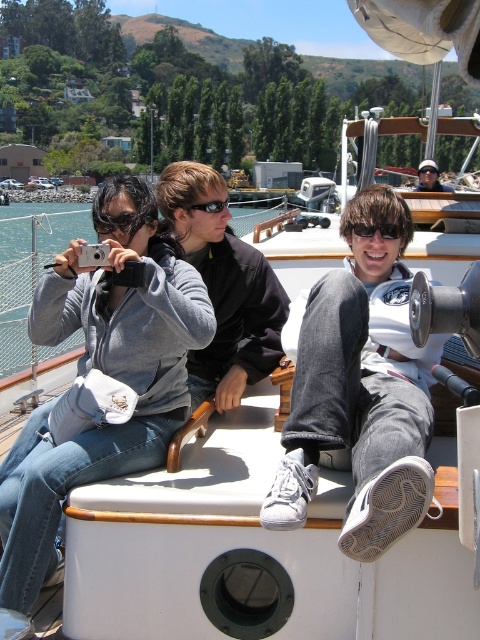
Is dark brown leather jacket at center smaller than black rubber sunglasses at center?

Incorrect, dark brown leather jacket at center is not smaller in size than black rubber sunglasses at center.

Measure the distance from dark brown leather jacket at center to black rubber sunglasses at center.

The distance of dark brown leather jacket at center from black rubber sunglasses at center is 17.88 inches.

Identify the location of dark brown leather jacket at center. This screenshot has width=480, height=640. (224, 288).

In order to click on dark brown leather jacket at center in this screenshot , I will do `click(224, 288)`.

Between matte black sunglasses at upper right and black rubber sunglasses at center, which one appears on the left side from the viewer's perspective?

black rubber sunglasses at center

Can you confirm if matte black sunglasses at upper right is wider than black rubber sunglasses at center?

Yes.

At what (x,y) coordinates should I click in order to perform the action: click on matte black sunglasses at upper right. Please return your answer as a coordinate pair (x, y). Looking at the image, I should click on (430, 177).

Can you confirm if dark brown leather jacket at center is taller than matte black sunglasses at upper right?

No, dark brown leather jacket at center is not taller than matte black sunglasses at upper right.

Can you confirm if dark brown leather jacket at center is positioned to the right of matte black sunglasses at upper right?

No, dark brown leather jacket at center is not to the right of matte black sunglasses at upper right.

Who is more forward, (173, 180) or (431, 164)?

Point (173, 180) is in front.

I want to click on dark brown leather jacket at center, so click(224, 288).